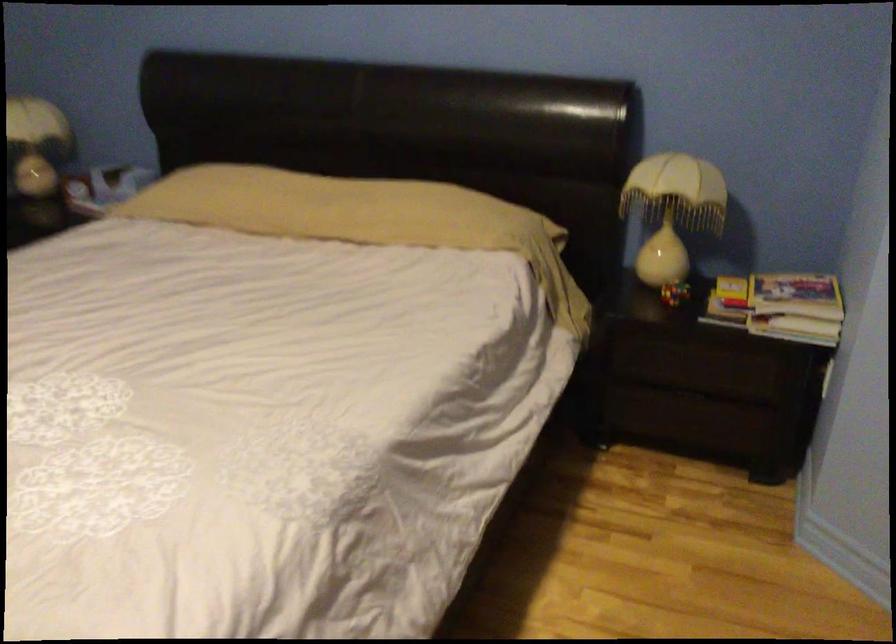
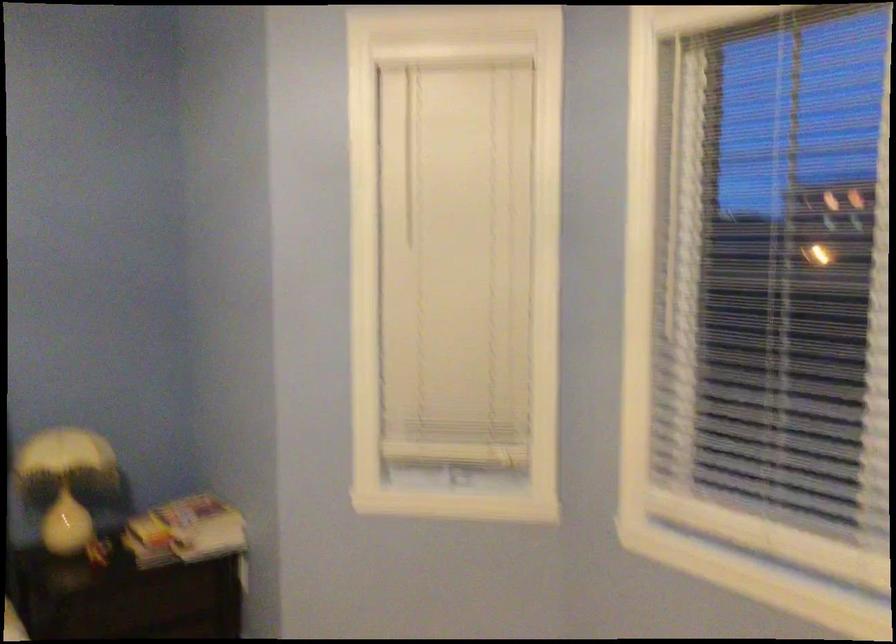
Find the pixel in the second image that matches pixel 763 303 in the first image.

(185, 532)